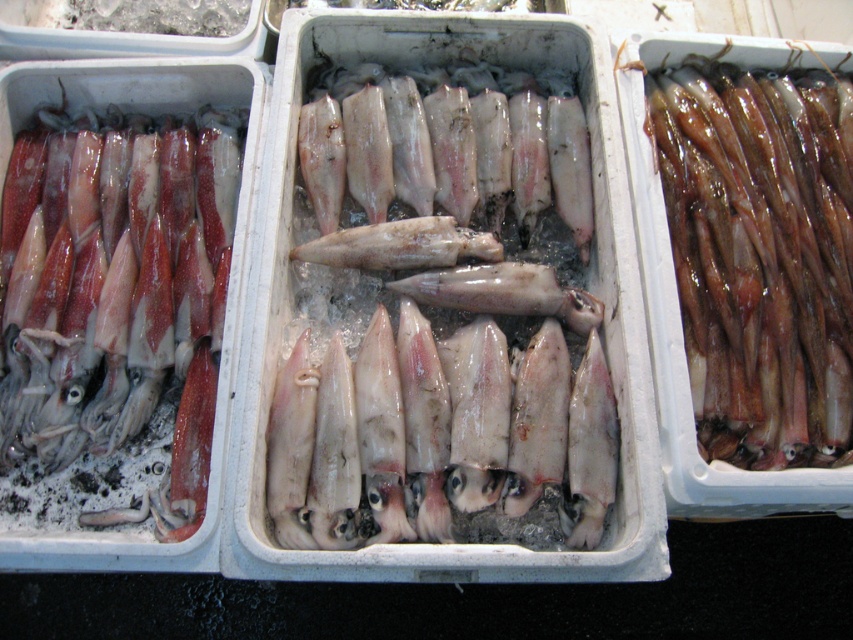
Which is more to the left, matte red squid at left or glistening wet squid at center?

matte red squid at left is more to the left.

Is the position of matte red squid at left more distant than that of glistening wet squid at center?

No, matte red squid at left is closer to the viewer.

Measure the distance between matte red squid at left and camera.

matte red squid at left and camera are 1.15 meters apart.

Where is `matte red squid at left`? matte red squid at left is located at coordinates (114, 314).

Who is more forward, (352, 346) or (706, 284)?

Point (352, 346) is more forward.

Which is more to the right, pale white glossy squid at center or glistening wet squid at center?

glistening wet squid at center is more to the right.

Who is more distant from viewer, (x=560, y=266) or (x=735, y=432)?

The point (x=560, y=266) is more distant.

Find the location of a particular element. The height and width of the screenshot is (640, 853). pale white glossy squid at center is located at coordinates (440, 317).

Is pale white glossy squid at center smaller than matte red squid at left?

No.

Who is more forward, (599, 314) or (28, 500)?

Point (28, 500)

Where is `pale white glossy squid at center`? pale white glossy squid at center is located at coordinates (440, 317).